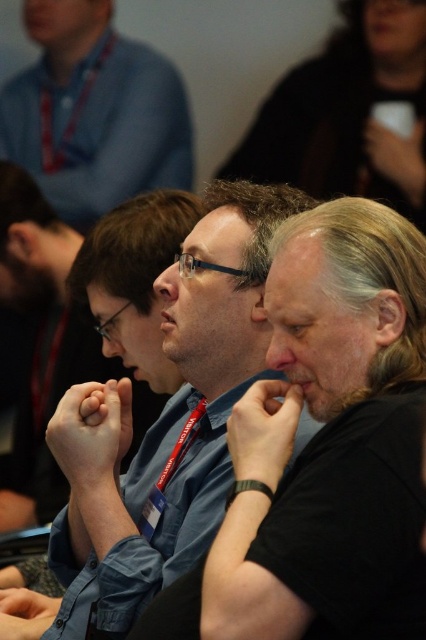
You are standing in the conference room and want to reach a specific point marked at coordinates point (91, 154). If you are currently 2.5 meters away from this point, how many more meters do you need to walk to reach it?

The distance of point (91, 154) from viewer is 3.00 meters. Since you are currently 2.5 meters away, you need to walk an additional 0.5 meters to reach the point.

Looking at this image, you are organizing a group photo and need to arrange the participants from smallest to largest based on their clothing size. Given the blue shirt at upper left and the gray matte hair at center, which should come first in the arrangement?

The blue shirt at upper left should come first in the arrangement since it has a smaller size compared to the gray matte hair at center.

In the conference setting, there are two men wearing blue shirts. The man with the matte blue shirt at center and the man with the blue shirt at upper left. Which one is positioned lower in the image?

The matte blue shirt at center is positioned below the blue shirt at upper left, so the matte blue shirt at center is lower in the image.